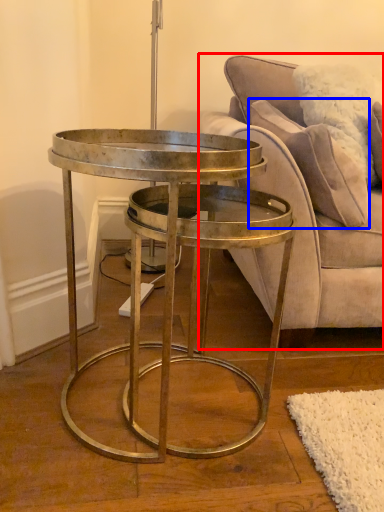
Question: Among these objects, which one is nearest to the camera, studio couch (highlighted by a red box) or pillow (highlighted by a blue box)?

Choices:
 (A) studio couch
 (B) pillow

Answer: (A)